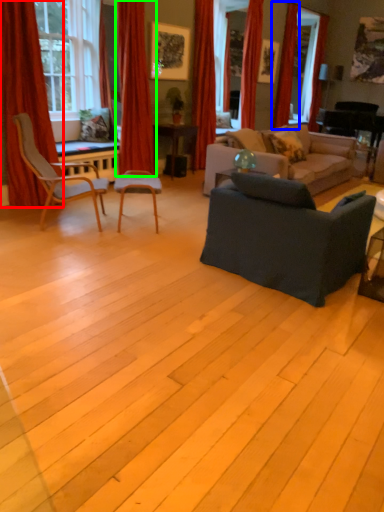
Question: Based on their relative distances, which object is farther from curtain (highlighted by a red box)? Choose from curtain (highlighted by a blue box) and curtain (highlighted by a green box).

Choices:
 (A) curtain
 (B) curtain

Answer: (A)